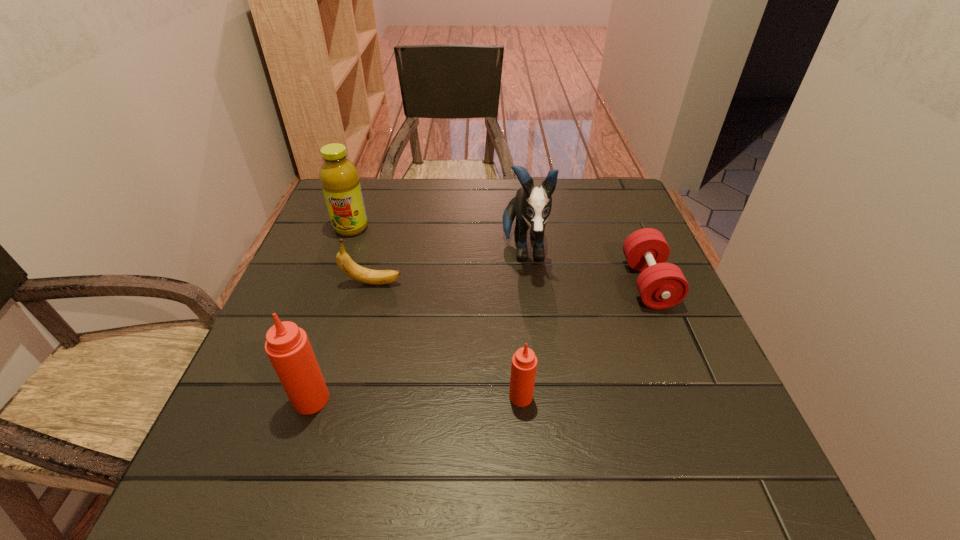
At what (x,y) coordinates should I click in order to perform the action: click on free point located 0.380m on the front-facing side of the tallest object. Please return your answer as a coordinate pair (x, y). The height and width of the screenshot is (540, 960). Looking at the image, I should click on (545, 434).

Locate an element on the screen. The image size is (960, 540). vacant space located on the left of the dumbbell is located at coordinates (469, 284).

Where is `vacant position located at the start of the peel on the banana`? Image resolution: width=960 pixels, height=540 pixels. vacant position located at the start of the peel on the banana is located at coordinates (539, 283).

Find the location of a particular element. The width and height of the screenshot is (960, 540). fruit juice present at the far edge is located at coordinates (339, 178).

Find the location of a particular element. The width and height of the screenshot is (960, 540). puppy that is at the far edge is located at coordinates (531, 206).

Image resolution: width=960 pixels, height=540 pixels. I want to click on Tabasco sauce that is at the left edge, so coord(288,348).

Identify the location of fruit juice that is at the left edge. (339, 178).

Where is `banana that is at the left edge`? banana that is at the left edge is located at coordinates (361, 274).

Locate an element on the screen. object at the right edge is located at coordinates (661, 285).

In order to click on object that is at the far left corner in this screenshot , I will do `click(339, 178)`.